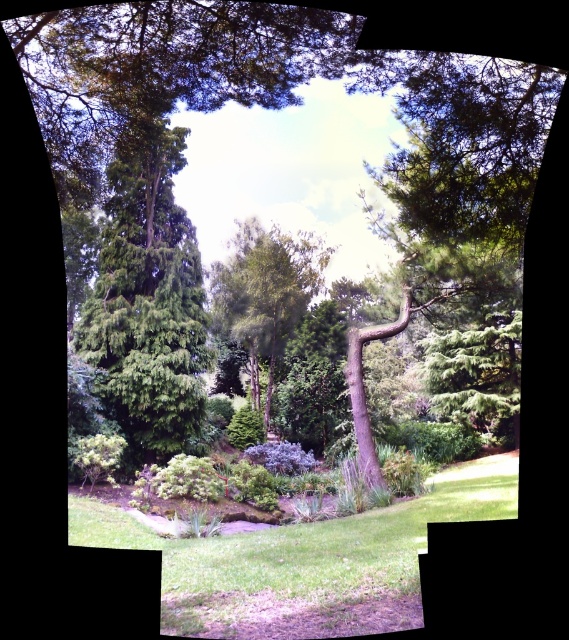
Question: Which object is the farthest from the green grass at center?

Choices:
 (A) green textured tree at left
 (B) green leafy tree at center

Answer: (B)

Question: Is green grass at center positioned before green textured tree at left?

Choices:
 (A) no
 (B) yes

Answer: (B)

Question: Which object is farther from the camera taking this photo?

Choices:
 (A) green grass at center
 (B) green leafy tree at center
 (C) green textured tree at left

Answer: (B)

Question: Where is green textured tree at left located in relation to green leafy tree at center in the image?

Choices:
 (A) right
 (B) left

Answer: (B)

Question: Considering the relative positions of green grass at center and green textured tree at left in the image provided, where is green grass at center located with respect to green textured tree at left?

Choices:
 (A) below
 (B) above

Answer: (A)

Question: Estimate the real-world distances between objects in this image. Which object is farther from the green textured tree at left?

Choices:
 (A) green leafy tree at center
 (B) green grass at center

Answer: (A)